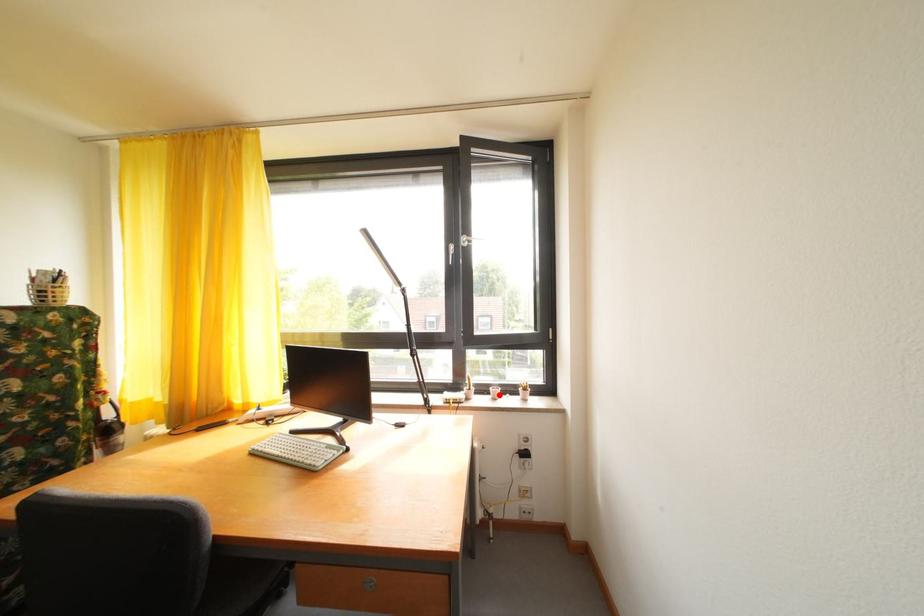
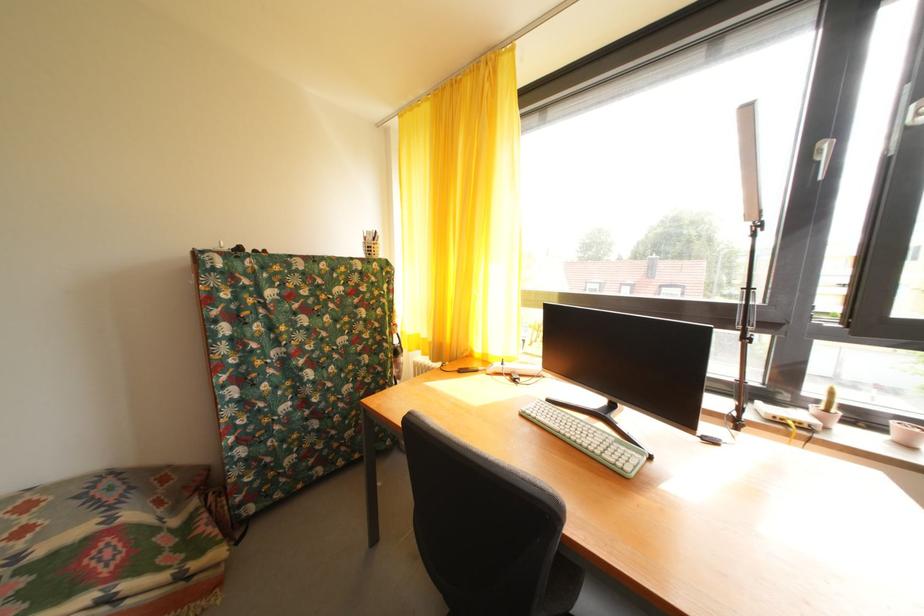
Find the pixel in the second image that matches the highlighted location in the first image.

(904, 430)